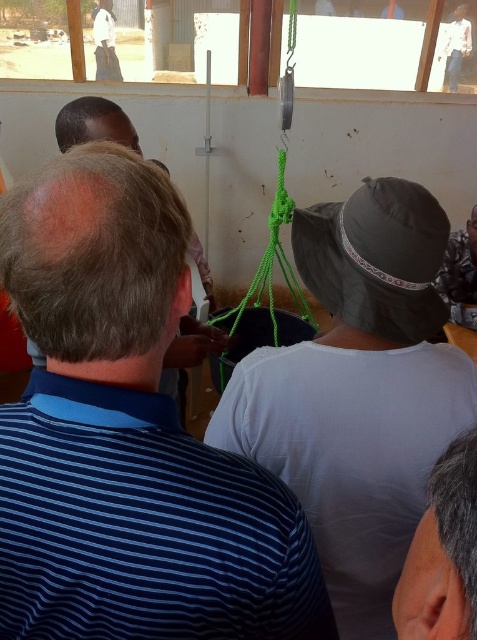
You are standing in the room and want to hand a tool to both the person wearing the white cotton shirt at center and the person wearing the white cotton shirt at upper right. Which person should you approach first to give the tool?

You should approach the white cotton shirt at center first because they are closer to you than the white cotton shirt at upper right.

You are a photographer trying to capture a clear photo of the blue striped shirt at center and the white cotton shirt at upper left. Which shirt should you focus on first to ensure both are in focus?

The blue striped shirt at center is in front of the white cotton shirt at upper left, so you should focus on the blue striped shirt at center first to ensure both are in focus.